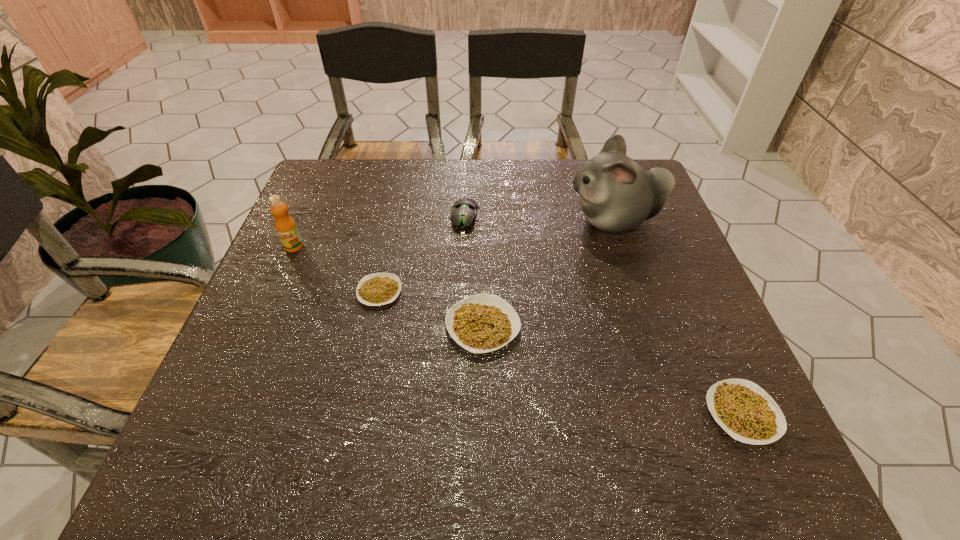
If equal spacing is the goal by inserting an additional legume among them, please point out a vacant space for this new legume. Please provide its 2D coordinates. Your answer should be formatted as a tuple, i.e. [(x, y)], where the tuple contains the x and y coordinates of a point satisfying the conditions above.

[(602, 366)]